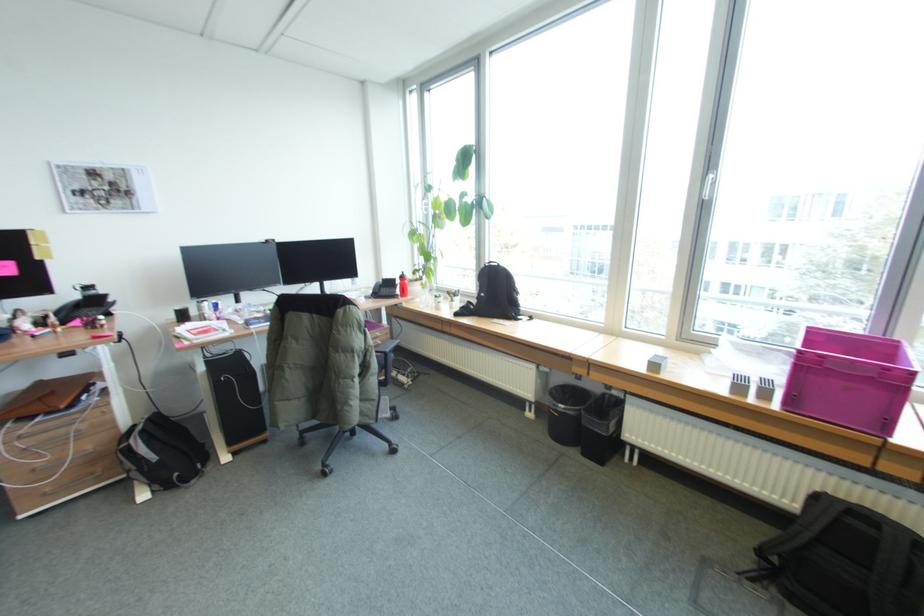
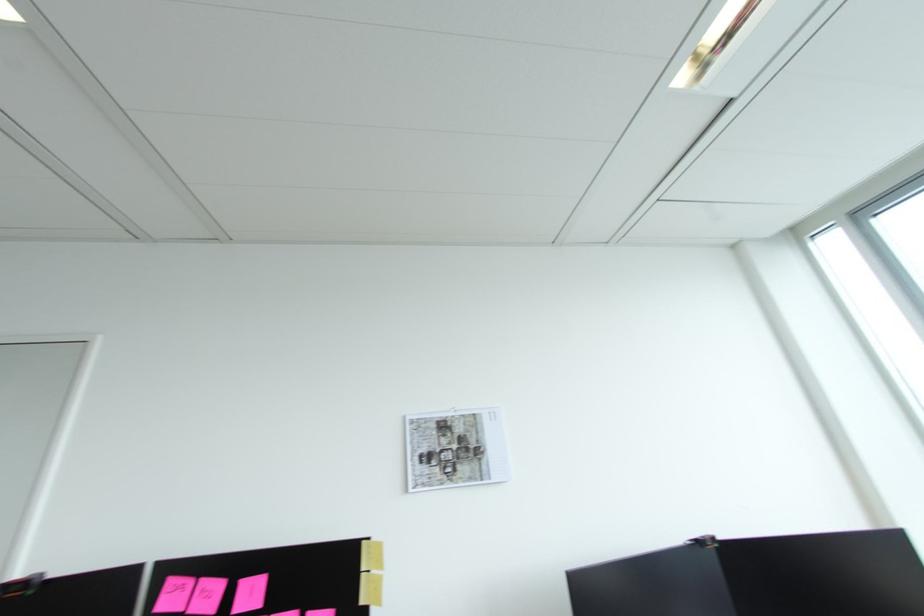
In the second image, find the point that corresponds to the point at 32,230 in the first image.

(368, 541)